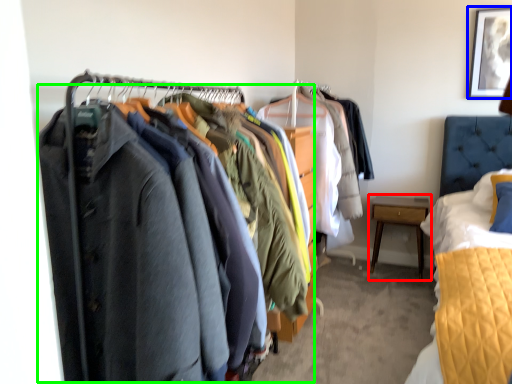
Question: Which is farther away from nightstand (highlighted by a red box)? picture frame (highlighted by a blue box) or closet (highlighted by a green box)?

Choices:
 (A) picture frame
 (B) closet

Answer: (B)